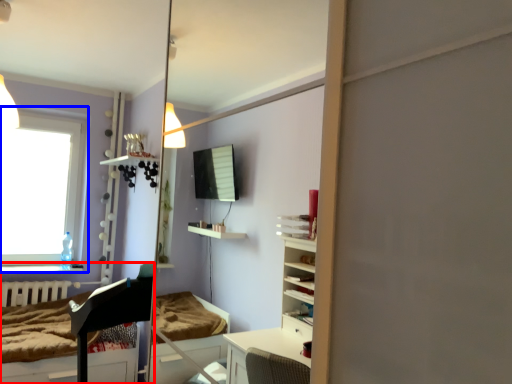
Question: Which point is closer to the camera, furniture (highlighted by a red box) or window (highlighted by a blue box)?

Choices:
 (A) furniture
 (B) window

Answer: (A)